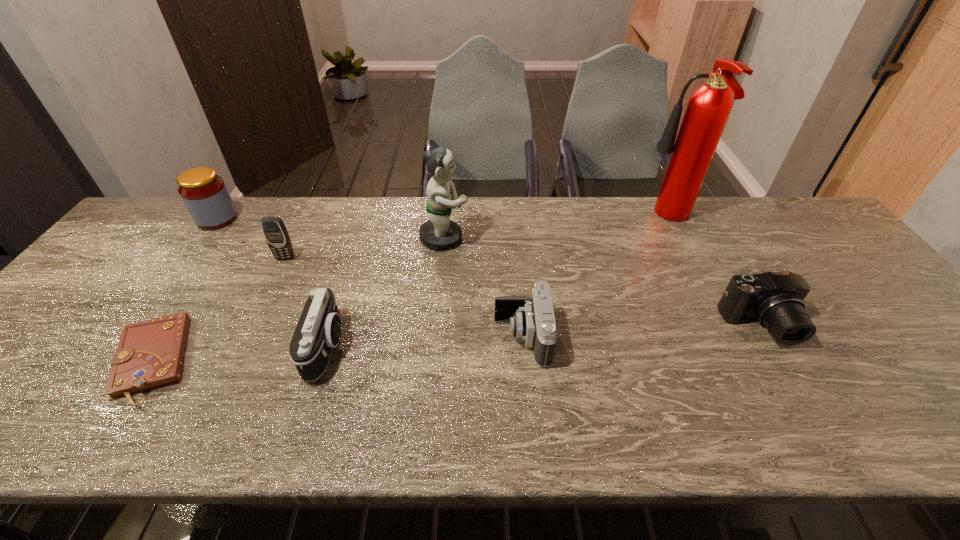
Where is `vacant area between the second camera from left to right and the shortest object`? The height and width of the screenshot is (540, 960). vacant area between the second camera from left to right and the shortest object is located at coordinates (337, 349).

At what (x,y) coordinates should I click in order to perform the action: click on object that ranks as the second closest to the cellular telephone. Please return your answer as a coordinate pair (x, y). The height and width of the screenshot is (540, 960). Looking at the image, I should click on (149, 355).

This screenshot has width=960, height=540. In order to click on the sixth closest object relative to the jar in this screenshot , I will do `click(708, 108)`.

Locate an element on the screen. The image size is (960, 540). the third closest camera to the fire extinguisher is located at coordinates (318, 330).

Identify which camera is located as the nearest to the fourth object from right to left. Please provide its 2D coordinates. Your answer should be formatted as a tuple, i.e. [(x, y)], where the tuple contains the x and y coordinates of a point satisfying the conditions above.

[(533, 320)]

Identify the location of free space that satisfies the following two spatial constraints: 1. on the lens of the rightmost camera; 2. on the front lens of the leftmost camera. This screenshot has width=960, height=540. (773, 346).

The image size is (960, 540). I want to click on vacant point that satisfies the following two spatial constraints: 1. on the front lens of the leftmost camera; 2. on the front side of the notebook, so click(x=324, y=360).